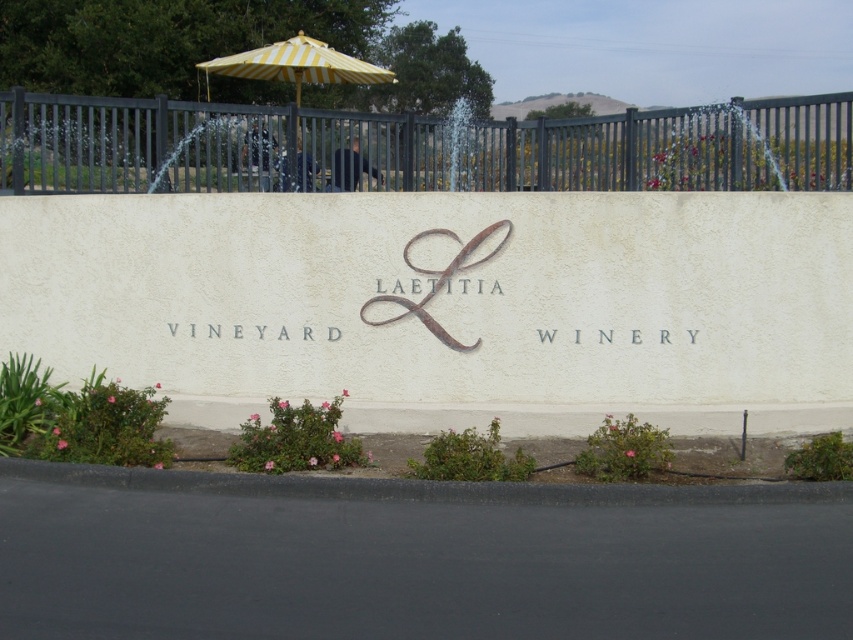
You are standing at the entrance of Laetitia Vineyard Winery and want to take a photo of the sign. Where should you position yourself to ensure the black metal fence at upper center is not blocking the view of the sign?

To avoid the black metal fence at upper center blocking the view, position yourself to the left or right of the fence, as it is located at coordinates point (416, 147). This placement allows you to frame the sign without obstruction.

You are standing in front of the Laetitia Vineyard Winery entrance and notice both the black metal fence at upper center and the yellow striped umbrella at upper center. Which object is bigger in size?

The black metal fence at upper center is larger in size compared to the yellow striped umbrella at upper center.

You are standing in front of the Laetitia Vineyard Winery entrance and notice the black metal fence at upper center and the yellow striped umbrella at upper center. Which object is positioned to the right from your perspective?

The black metal fence at upper center is to the right of the yellow striped umbrella at upper center.